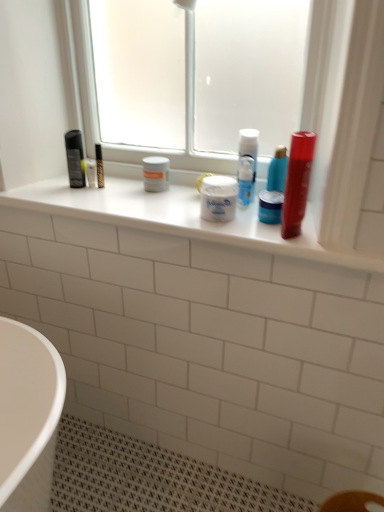
Locate an element on the screen. The height and width of the screenshot is (512, 384). vacant space in front of white matte jar at center is located at coordinates (240, 228).